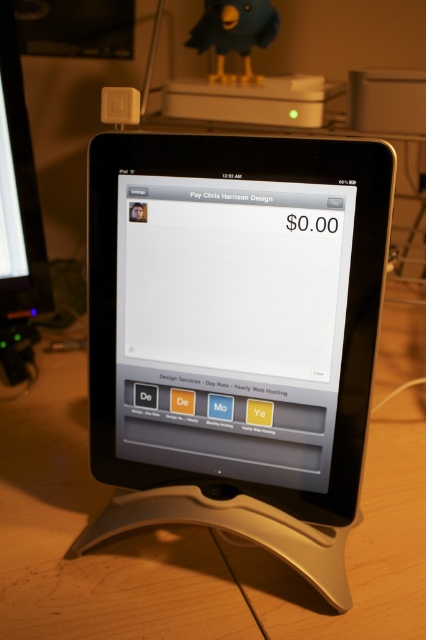
Question: Where is black matte tablet at center located in relation to matte black tablet at center in the image?

Choices:
 (A) above
 (B) below

Answer: (B)

Question: From the image, what is the correct spatial relationship of black matte tablet at center in relation to matte black tablet at center?

Choices:
 (A) below
 (B) above

Answer: (A)

Question: Which of the following is the farthest from the observer?

Choices:
 (A) (339, 332)
 (B) (340, 392)

Answer: (B)

Question: Among these objects, which one is nearest to the camera?

Choices:
 (A) matte black tablet at center
 (B) black matte tablet at center

Answer: (B)

Question: Does black matte tablet at center come behind matte black tablet at center?

Choices:
 (A) yes
 (B) no

Answer: (B)